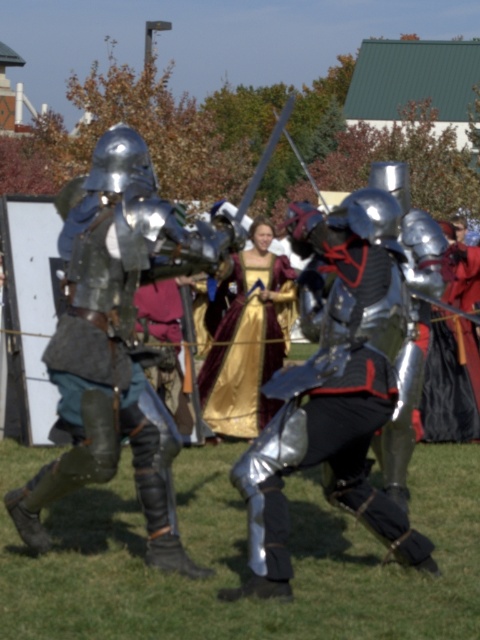
You are standing in the medieval reenactment area and want to locate the shiny silver armor at left. Which direction should you look to find it?

The shiny silver armor at left is located at point 0.544 on the x axis and 0.237 on the y axis, so you should look to the left side of the image to find it.

You are a photographer at this medieval event. You want to capture a photo where both the shiny silver armor at center and the gold satin dress at center are clearly visible. Considering their sizes, which object should you position closer to the camera to ensure both are in focus?

The shiny silver armor at center is bigger than the gold satin dress at center. To ensure both are in focus, position the gold satin dress at center closer to the camera since smaller objects need to be nearer to maintain clarity in the photo.